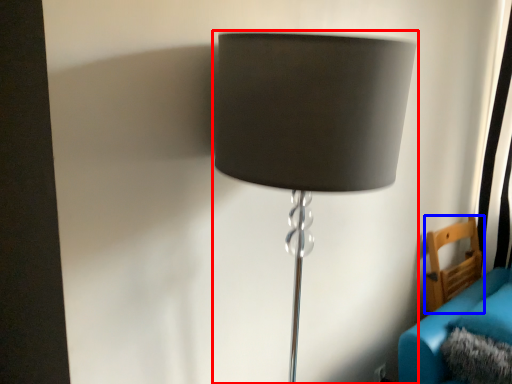
Question: Which of the following is the closest to the observer, lamp (highlighted by a red box) or furniture (highlighted by a blue box)?

Choices:
 (A) lamp
 (B) furniture

Answer: (A)